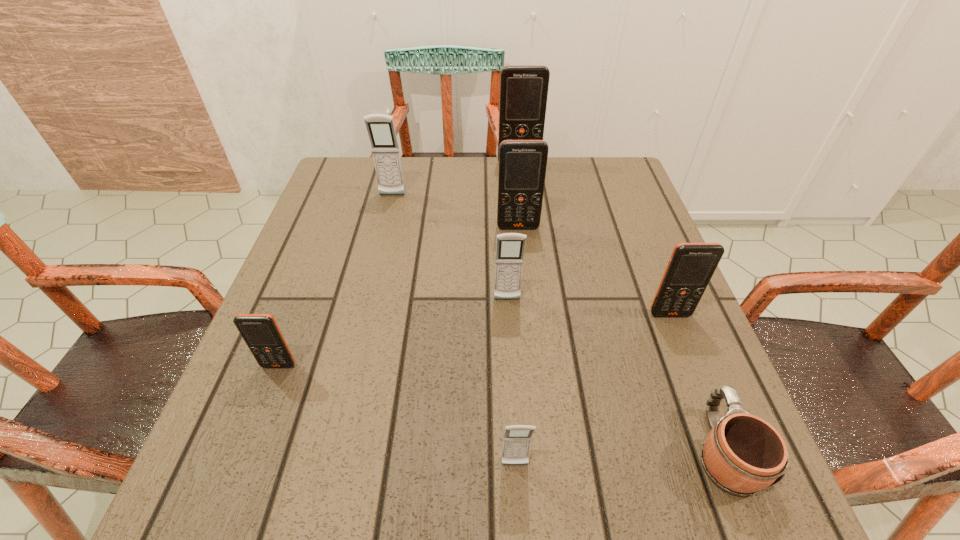
The image size is (960, 540). What are the coordinates of `free spot located 0.130m on the screen of the smallest orange cellular telephone` in the screenshot? It's located at (251, 441).

In order to click on vacant area located on the side of the shortest object with the handle in this screenshot , I will do tap(678, 338).

At what (x,y) coordinates should I click in order to perform the action: click on free space located 0.180m on the side of the shortest object with the handle. Please return your answer as a coordinate pair (x, y). The image size is (960, 540). Looking at the image, I should click on (671, 321).

The width and height of the screenshot is (960, 540). I want to click on free space located 0.160m on the side of the shortest object with the handle, so click(675, 329).

Where is `cellular telephone that is at the near edge`? cellular telephone that is at the near edge is located at coordinates (517, 439).

In order to click on mug that is at the near edge in this screenshot , I will do `click(743, 454)`.

Locate an element on the screen. cellular telephone that is at the right edge is located at coordinates (691, 266).

Find the location of a particular element. mug present at the right edge is located at coordinates (743, 454).

Find the location of a particular element. The height and width of the screenshot is (540, 960). object positioned at the far left corner is located at coordinates point(380,127).

What are the coordinates of `object at the near right corner` in the screenshot? It's located at (743, 454).